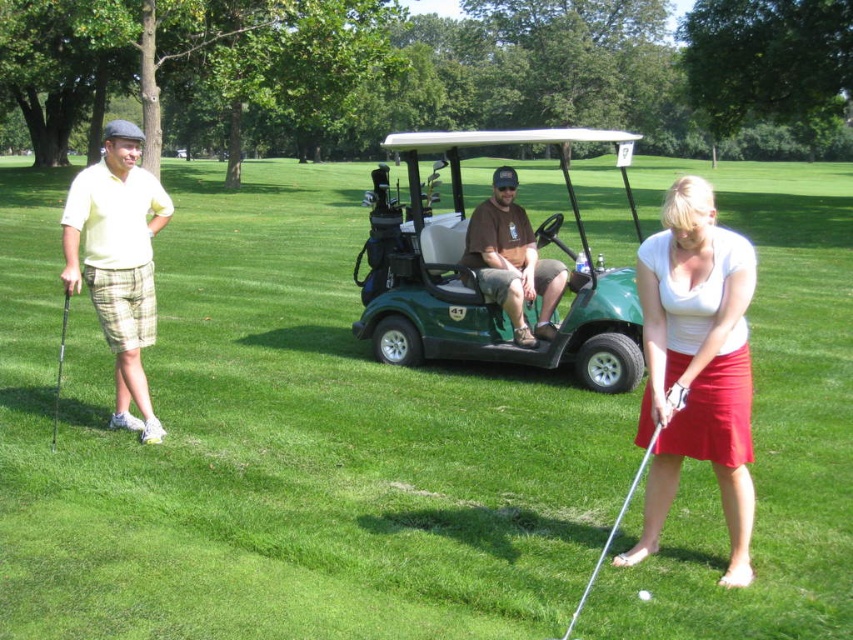
In the scene shown: Who is higher up, green matte golf cart at center or light yellow cotton polo shirt at left?

green matte golf cart at center

Is point (402, 266) farther from camera compared to point (151, 225)?

Yes, point (402, 266) is behind point (151, 225).

The image size is (853, 640). What do you see at coordinates (479, 275) in the screenshot?
I see `green matte golf cart at center` at bounding box center [479, 275].

Image resolution: width=853 pixels, height=640 pixels. What are the coordinates of `green matte golf cart at center` in the screenshot? It's located at (479, 275).

Does white matte skirt at lower right have a lesser width compared to metallic silver golf club at left?

Yes, white matte skirt at lower right is thinner than metallic silver golf club at left.

Is point (735, 234) positioned in front of point (62, 352)?

Yes, point (735, 234) is closer to viewer.

Between point (729, 289) and point (64, 305), which one is positioned in front?

Positioned in front is point (729, 289).

Where is `white matte skirt at lower right`? white matte skirt at lower right is located at coordinates (695, 365).

Describe the element at coordinates (695, 365) in the screenshot. I see `white matte skirt at lower right` at that location.

Can you confirm if white matte skirt at lower right is positioned to the right of white matte golf ball at center?

Correct, you'll find white matte skirt at lower right to the right of white matte golf ball at center.

Who is more forward, (733,262) or (647,598)?

Positioned in front is point (733,262).

Find the location of a particular element. white matte skirt at lower right is located at coordinates (695, 365).